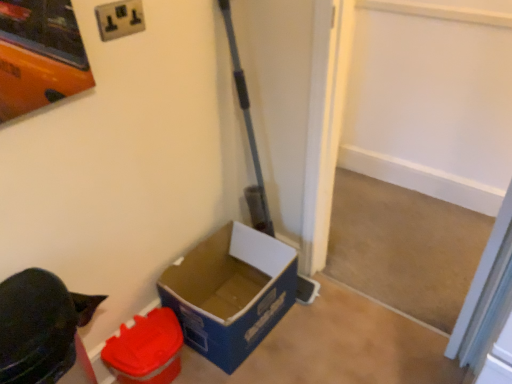
Describe the element at coordinates (230, 292) in the screenshot. I see `blue cardboard box at lower left, arranged as the 1th box when viewed from the right` at that location.

Locate an element on the screen. The height and width of the screenshot is (384, 512). matte plastic container at lower left, the 1th box viewed from the left is located at coordinates (146, 349).

Looking at this image, is white plastic electric outlet at upper center at the back of matte plastic container at lower left, the 1th box viewed from the left?

No.

This screenshot has height=384, width=512. I want to click on box lying on the left of white plastic electric outlet at upper center, so click(146, 349).

Is matte plastic container at lower left, the second box in the right-to-left sequence, further to the viewer compared to white plastic electric outlet at upper center?

Yes, matte plastic container at lower left, the second box in the right-to-left sequence, is behind white plastic electric outlet at upper center.

Considering the relative sizes of blue cardboard box at lower left, the 2th box from the left, and matte plastic container at lower left, the 1th box viewed from the left, in the image provided, is blue cardboard box at lower left, the 2th box from the left, shorter than matte plastic container at lower left, the 1th box viewed from the left,?

No, blue cardboard box at lower left, the 2th box from the left, is not shorter than matte plastic container at lower left, the 1th box viewed from the left.

Is blue cardboard box at lower left, the 2th box from the left, behind matte plastic container at lower left, the second box in the right-to-left sequence?

Yes, blue cardboard box at lower left, the 2th box from the left, is further from the camera.

From a real-world perspective, is blue cardboard box at lower left, the 2th box from the left, positioned over matte plastic container at lower left, the second box in the right-to-left sequence, based on gravity?

Yes.

Based on the photo, which object is positioned more to the left, blue cardboard box at lower left, arranged as the 1th box when viewed from the right, or matte plastic container at lower left, the second box in the right-to-left sequence?

Positioned to the left is matte plastic container at lower left, the second box in the right-to-left sequence.

Looking at the image, does white plastic electric outlet at upper center seem bigger or smaller compared to matte plastic container at lower left, the second box in the right-to-left sequence?

white plastic electric outlet at upper center is smaller than matte plastic container at lower left, the second box in the right-to-left sequence.

Is white plastic electric outlet at upper center completely or partially outside of matte plastic container at lower left, the 1th box viewed from the left?

Yes, white plastic electric outlet at upper center is outside of matte plastic container at lower left, the 1th box viewed from the left.

Between white plastic electric outlet at upper center and matte plastic container at lower left, the second box in the right-to-left sequence, which one has larger width?

matte plastic container at lower left, the second box in the right-to-left sequence.

From the image's perspective, does white plastic electric outlet at upper center appear lower than matte plastic container at lower left, the 1th box viewed from the left?

Incorrect, from the image's perspective, white plastic electric outlet at upper center is higher than matte plastic container at lower left, the 1th box viewed from the left.

Is blue cardboard box at lower left, arranged as the 1th box when viewed from the right, in front of or behind white plastic electric outlet at upper center in the image?

blue cardboard box at lower left, arranged as the 1th box when viewed from the right, is positioned farther from the viewer than white plastic electric outlet at upper center.

Between blue cardboard box at lower left, arranged as the 1th box when viewed from the right, and white plastic electric outlet at upper center, which one has smaller width?

With smaller width is white plastic electric outlet at upper center.

From a real-world perspective, is blue cardboard box at lower left, the 2th box from the left, located higher than white plastic electric outlet at upper center?

No.

Does point (259, 298) come behind point (104, 12)?

Yes, point (259, 298) is behind point (104, 12).

Is white plastic electric outlet at upper center facing away from blue cardboard box at lower left, the 2th box from the left?

white plastic electric outlet at upper center is not turned away from blue cardboard box at lower left, the 2th box from the left.

In order to click on the 1st box located beneath the white plastic electric outlet at upper center (from a real-world perspective) in this screenshot , I will do `click(230, 292)`.

Is white plastic electric outlet at upper center shorter than blue cardboard box at lower left, the 2th box from the left?

Yes, white plastic electric outlet at upper center is shorter than blue cardboard box at lower left, the 2th box from the left.

How far apart are white plastic electric outlet at upper center and blue cardboard box at lower left, the 2th box from the left?

A distance of 1.01 meters exists between white plastic electric outlet at upper center and blue cardboard box at lower left, the 2th box from the left.

Which point is more forward, (122, 329) or (246, 235)?

The point (122, 329) is closer.

Can you confirm if matte plastic container at lower left, the 1th box viewed from the left, is wider than blue cardboard box at lower left, the 2th box from the left?

No, matte plastic container at lower left, the 1th box viewed from the left, is not wider than blue cardboard box at lower left, the 2th box from the left.

Where is `box below the blue cardboard box at lower left, the 2th box from the left (from the image's perspective)`? The width and height of the screenshot is (512, 384). box below the blue cardboard box at lower left, the 2th box from the left (from the image's perspective) is located at coordinates (146, 349).

Is matte plastic container at lower left, the second box in the right-to-left sequence, positioned with its back to blue cardboard box at lower left, the 2th box from the left?

No.

I want to click on box to the left of white plastic electric outlet at upper center, so click(146, 349).

What are the coordinates of `box on the right of matte plastic container at lower left, the second box in the right-to-left sequence` in the screenshot? It's located at (230, 292).

When comparing their distances from white plastic electric outlet at upper center, does matte plastic container at lower left, the 1th box viewed from the left, or blue cardboard box at lower left, the 2th box from the left, seem closer?

Based on the image, matte plastic container at lower left, the 1th box viewed from the left, appears to be nearer to white plastic electric outlet at upper center.

Which object lies further to the anchor point blue cardboard box at lower left, the 2th box from the left, white plastic electric outlet at upper center or matte plastic container at lower left, the second box in the right-to-left sequence?

white plastic electric outlet at upper center is positioned further to the anchor blue cardboard box at lower left, the 2th box from the left.

Estimate the real-world distances between objects in this image. Which object is further from matte plastic container at lower left, the 1th box viewed from the left, white plastic electric outlet at upper center or blue cardboard box at lower left, arranged as the 1th box when viewed from the right?

white plastic electric outlet at upper center is further to matte plastic container at lower left, the 1th box viewed from the left.

From the image, which object appears to be farther from matte plastic container at lower left, the 1th box viewed from the left, blue cardboard box at lower left, arranged as the 1th box when viewed from the right, or white plastic electric outlet at upper center?

Among the two, white plastic electric outlet at upper center is located further to matte plastic container at lower left, the 1th box viewed from the left.

Which object lies further to the anchor point blue cardboard box at lower left, the 2th box from the left, matte plastic container at lower left, the second box in the right-to-left sequence, or white plastic electric outlet at upper center?

Among the two, white plastic electric outlet at upper center is located further to blue cardboard box at lower left, the 2th box from the left.

From the image, which object appears to be nearer to white plastic electric outlet at upper center, blue cardboard box at lower left, the 2th box from the left, or matte plastic container at lower left, the second box in the right-to-left sequence?

Based on the image, matte plastic container at lower left, the second box in the right-to-left sequence, appears to be nearer to white plastic electric outlet at upper center.

At what (x,y) coordinates should I click in order to perform the action: click on box between white plastic electric outlet at upper center and matte plastic container at lower left, the 1th box viewed from the left, in the vertical direction. Please return your answer as a coordinate pair (x, y). Looking at the image, I should click on (230, 292).